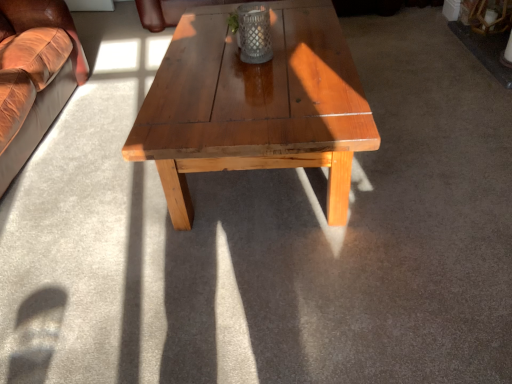
Identify the location of empty space that is to the right of leather couch at left. (132, 163).